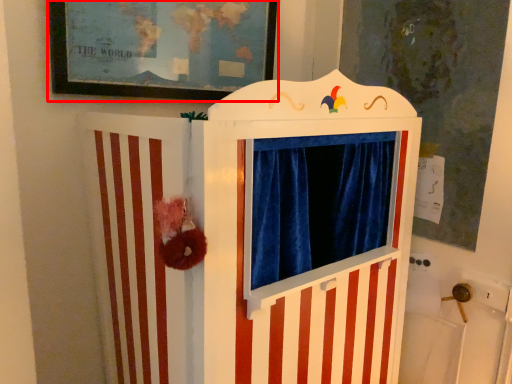
Question: Observing the image, what is the correct spatial positioning of picture frame (annotated by the red box) in reference to furniture?

Choices:
 (A) left
 (B) right

Answer: (A)